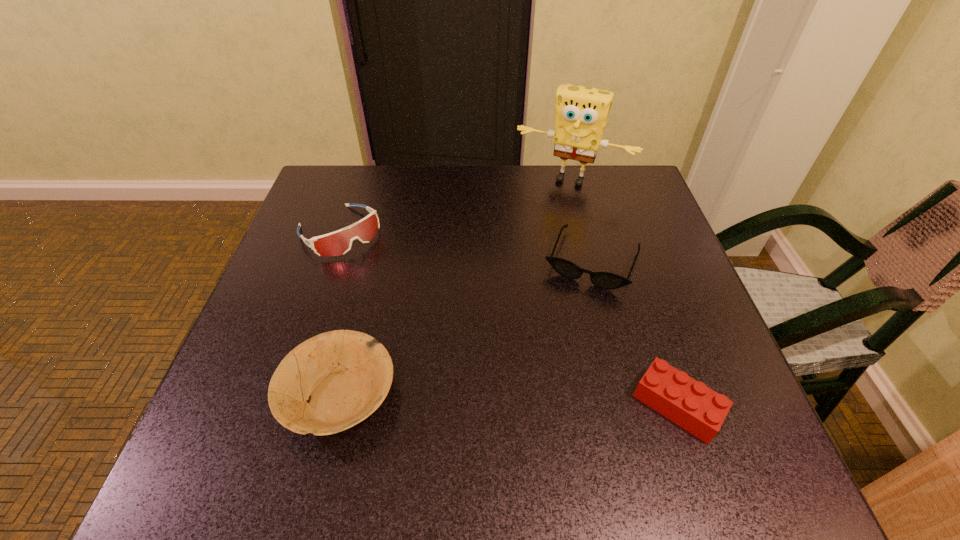
Locate an element on the screen. The image size is (960, 540). vacant space located 0.220m on the front-facing side of the sunglasses is located at coordinates (546, 376).

This screenshot has width=960, height=540. What are the coordinates of `free space located 0.250m on the front-facing side of the goggles` in the screenshot? It's located at (420, 319).

Find the location of a particular element. This screenshot has width=960, height=540. free spot located on the front-facing side of the goggles is located at coordinates (420, 319).

The width and height of the screenshot is (960, 540). Find the location of `free space located 0.190m on the front-facing side of the goggles`. free space located 0.190m on the front-facing side of the goggles is located at coordinates (404, 301).

Locate an element on the screen. free space located 0.220m on the face of the farthest object is located at coordinates (529, 243).

Image resolution: width=960 pixels, height=540 pixels. Find the location of `vacant space located on the face of the farthest object`. vacant space located on the face of the farthest object is located at coordinates (547, 205).

Find the location of a particular element. This screenshot has width=960, height=540. vacant space located 0.110m on the face of the farthest object is located at coordinates (541, 216).

Locate an element on the screen. goggles positioned at the far edge is located at coordinates (339, 243).

You are a GUI agent. You are given a task and a screenshot of the screen. Output one action in this format:
    pyautogui.click(x=<x>, y=<y>)
    Task: Click on the sponge situated at the far edge
    This screenshot has height=540, width=960.
    Given the screenshot: What is the action you would take?
    pyautogui.click(x=581, y=115)

You are a GUI agent. You are given a task and a screenshot of the screen. Output one action in this format:
    pyautogui.click(x=<x>, y=<y>)
    Task: Click on the bowl located at the near edge
    This screenshot has width=960, height=540.
    Given the screenshot: What is the action you would take?
    pyautogui.click(x=345, y=375)